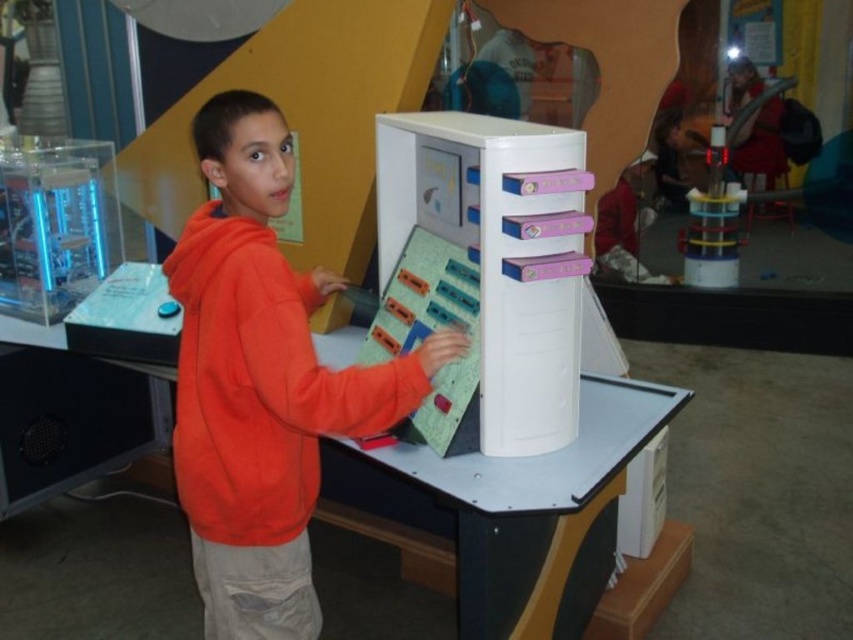
Question: Which of the following is the closest to the observer?

Choices:
 (A) orange fleece at center
 (B) white plastic table at center

Answer: (A)

Question: Does orange fleece at center have a greater width compared to white plastic table at center?

Choices:
 (A) no
 (B) yes

Answer: (A)

Question: Is the position of orange fleece at center more distant than that of white plastic table at center?

Choices:
 (A) no
 (B) yes

Answer: (A)

Question: Can you confirm if orange fleece at center is smaller than white plastic table at center?

Choices:
 (A) no
 (B) yes

Answer: (B)

Question: Which point is farther from the camera taking this photo?

Choices:
 (A) (281, 600)
 (B) (589, 561)

Answer: (B)

Question: Which point appears closest to the camera in this image?

Choices:
 (A) (483, 573)
 (B) (239, 422)

Answer: (B)